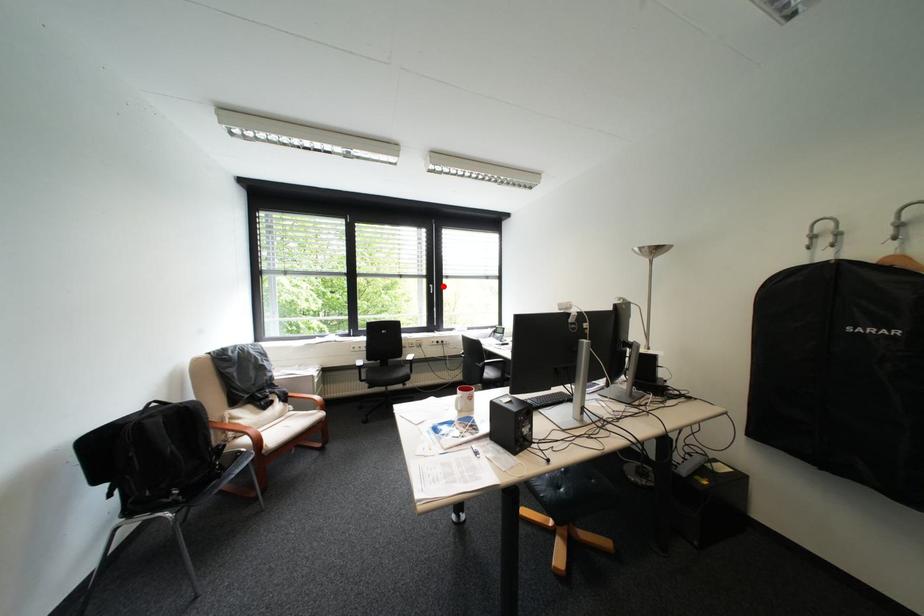
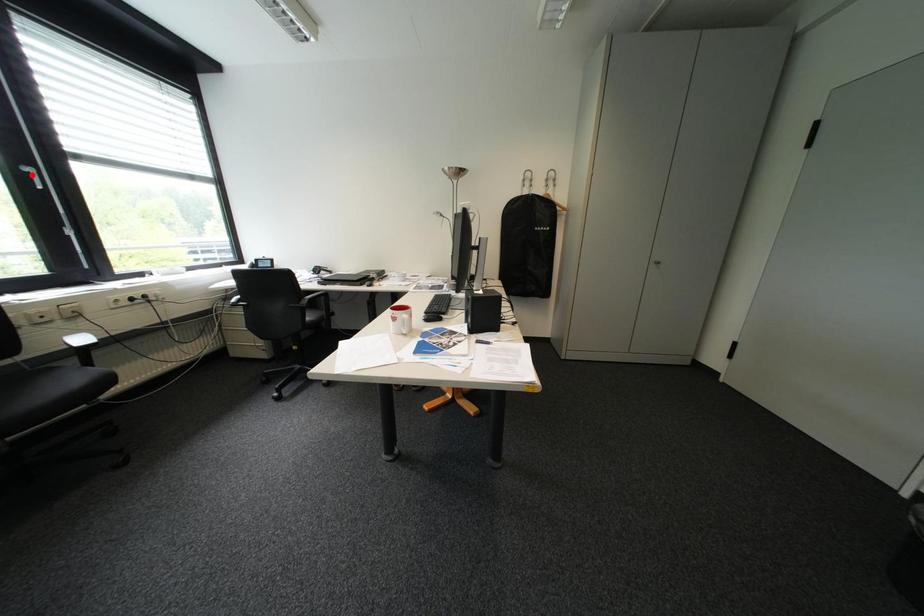
I am providing you with two images of the same scene from different viewpoints. A red point is marked on the first image and another point is marked on the second image. Is the red point in image1 aligned with the point shown in image2?

No